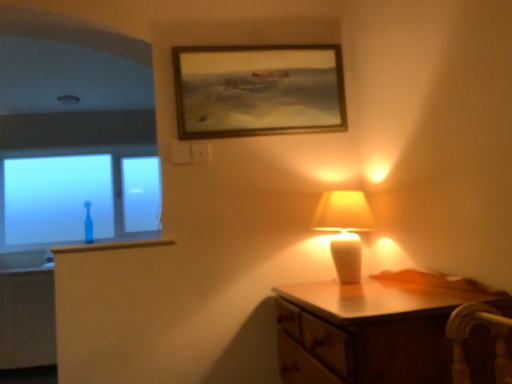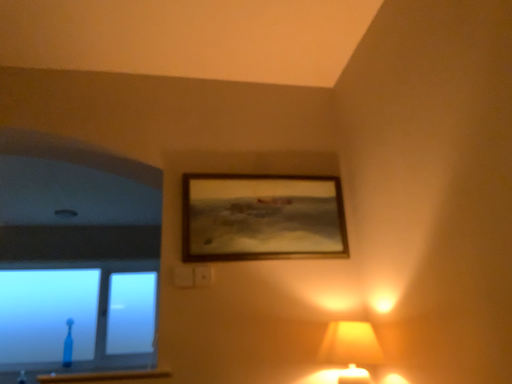
Question: How did the camera likely rotate when shooting the video?

Choices:
 (A) rotated downward
 (B) rotated upward

Answer: (B)